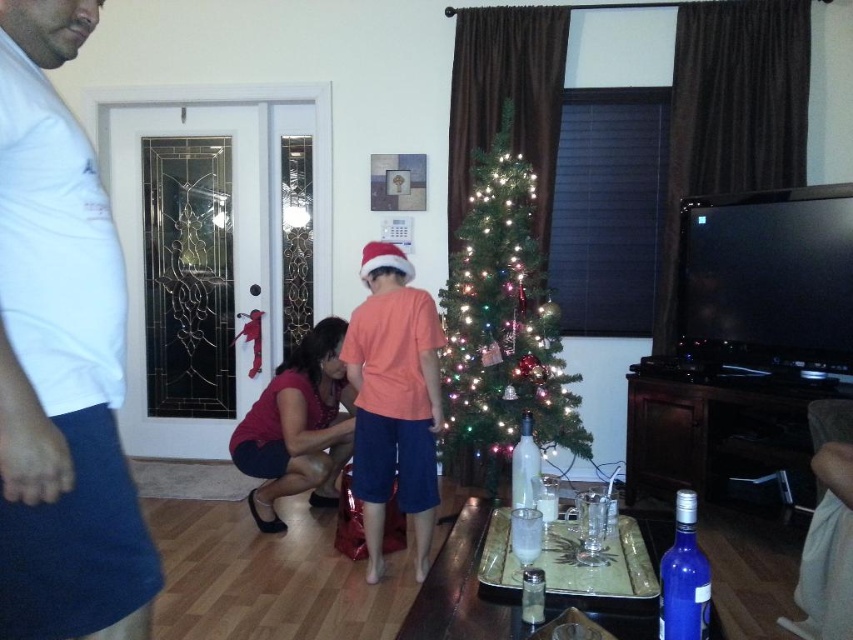
Consider the image. Does green matte christmas tree at center have a larger size compared to orange matte shirt at center?

Yes.

Is point (511, 128) behind point (404, 406)?

Yes, it is behind point (404, 406).

Where is `green matte christmas tree at center`? This screenshot has height=640, width=853. green matte christmas tree at center is located at coordinates (502, 326).

Between orange matte shirt at center and blue glass bottle at lower right, which one has more height?

orange matte shirt at center is taller.

Can you confirm if orange matte shirt at center is positioned below blue glass bottle at lower right?

No, orange matte shirt at center is not below blue glass bottle at lower right.

Identify the location of orange matte shirt at center. This screenshot has width=853, height=640. (393, 400).

Is point (21, 266) more distant than point (389, 374)?

No, (21, 266) is in front of (389, 374).

Find the location of a particular element. This screenshot has height=640, width=853. white t-shirt at left is located at coordinates (61, 358).